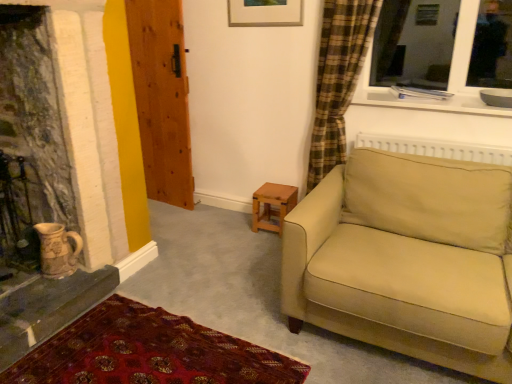
At what (x,y) coordinates should I click in order to perform the action: click on carpet with intricate patterns at lower left. Please return your answer as a coordinate pair (x, y). Looking at the image, I should click on (148, 352).

From the picture: Measure the distance between wooden table at center and camera.

wooden table at center and camera are 9.09 feet apart.

At what (x,y) coordinates should I click in order to perform the action: click on carpet with intricate patterns at lower left. Please return your answer as a coordinate pair (x, y). The width and height of the screenshot is (512, 384). Looking at the image, I should click on (148, 352).

Measure the distance between earthenware jug at lower left and beige fabric couch at right.

earthenware jug at lower left and beige fabric couch at right are 1.50 meters apart.

Does point (38, 223) lie in front of point (362, 317)?

No, it is not.

In terms of height, does earthenware jug at lower left look taller or shorter compared to beige fabric couch at right?

earthenware jug at lower left is shorter than beige fabric couch at right.

From a real-world perspective, is earthenware jug at lower left physically above beige fabric couch at right?

Incorrect, from a real-world perspective, earthenware jug at lower left is lower than beige fabric couch at right.

Locate an element on the screen. studio couch that appears above the wooden table at center (from a real-world perspective) is located at coordinates (407, 259).

Which is in front, beige fabric couch at right or wooden table at center?

beige fabric couch at right.

Is beige fabric couch at right inside or outside of wooden table at center?

beige fabric couch at right is not enclosed by wooden table at center.

Considering the relative sizes of beige fabric couch at right and wooden table at center in the image provided, is beige fabric couch at right bigger than wooden table at center?

Yes, beige fabric couch at right is bigger than wooden table at center.

Considering the relative sizes of carpet with intricate patterns at lower left and wooden door at left in the image provided, is carpet with intricate patterns at lower left bigger than wooden door at left?

No.

Considering the relative positions of carpet with intricate patterns at lower left and wooden door at left in the image provided, is carpet with intricate patterns at lower left to the left or to the right of wooden door at left?

Based on their positions, carpet with intricate patterns at lower left is located to the right of wooden door at left.

Measure the distance between carpet with intricate patterns at lower left and wooden door at left.

They are 5.15 feet apart.

Is carpet with intricate patterns at lower left not near wooden door at left?

Absolutely, carpet with intricate patterns at lower left is distant from wooden door at left.

Relative to earthenware jug at lower left, is beige fabric couch at right in front or behind?

Visually, beige fabric couch at right is located in front of earthenware jug at lower left.

Where is `tea pot below the beige fabric couch at right (from the image's perspective)`? Image resolution: width=512 pixels, height=384 pixels. tea pot below the beige fabric couch at right (from the image's perspective) is located at coordinates (58, 250).

In terms of width, does beige fabric couch at right look wider or thinner when compared to earthenware jug at lower left?

Clearly, beige fabric couch at right has more width compared to earthenware jug at lower left.

Is beige fabric couch at right not close to earthenware jug at lower left?

Yes, beige fabric couch at right is far from earthenware jug at lower left.

Consider the image. Does wooden door at left have a smaller size compared to wooden table at center?

No, wooden door at left is not smaller than wooden table at center.

Looking at this image, what's the angular difference between wooden door at left and wooden table at center's facing directions?

10.5 degrees separate the facing orientations of wooden door at left and wooden table at center.

Between wooden door at left and wooden table at center, which one appears on the left side from the viewer's perspective?

From the viewer's perspective, wooden door at left appears more on the left side.

From a real-world perspective, between wooden door at left and wooden table at center, who is vertically higher?

wooden door at left is physically above.

From a real-world perspective, is carpet with intricate patterns at lower left on beige fabric couch at right?

Incorrect, from a real-world perspective, carpet with intricate patterns at lower left is lower than beige fabric couch at right.

In the scene shown: Can you tell me how much carpet with intricate patterns at lower left and beige fabric couch at right differ in facing direction?

87.5 degrees.

Considering the relative positions of carpet with intricate patterns at lower left and beige fabric couch at right in the image provided, is carpet with intricate patterns at lower left to the left of beige fabric couch at right from the viewer's perspective?

Yes.

Does carpet with intricate patterns at lower left have a lesser width compared to wooden table at center?

No.

Is carpet with intricate patterns at lower left touching wooden table at center?

There is a gap between carpet with intricate patterns at lower left and wooden table at center.

Is carpet with intricate patterns at lower left not inside wooden table at center?

carpet with intricate patterns at lower left is positioned outside wooden table at center.

In order to click on studio couch that appears in front of the earthenware jug at lower left in this screenshot , I will do `click(407, 259)`.

At what (x,y) coordinates should I click in order to perform the action: click on table lying behind the beige fabric couch at right. Please return your answer as a coordinate pair (x, y). The image size is (512, 384). Looking at the image, I should click on (272, 206).

When comparing their distances from wooden door at left, does wooden table at center or beige fabric couch at right seem closer?

Among the two, wooden table at center is located nearer to wooden door at left.

Considering their positions, is beige fabric couch at right positioned closer to carpet with intricate patterns at lower left than wooden door at left?

beige fabric couch at right.

From the image, which object appears to be farther from wooden table at center, carpet with intricate patterns at lower left or wooden door at left?

Based on the image, carpet with intricate patterns at lower left appears to be further to wooden table at center.

From the image, which object appears to be farther from earthenware jug at lower left, wooden door at left or wooden table at center?

The object further to earthenware jug at lower left is wooden door at left.

Considering their positions, is wooden table at center positioned closer to beige fabric couch at right than carpet with intricate patterns at lower left?

carpet with intricate patterns at lower left is positioned closer to the anchor beige fabric couch at right.

From the image, which object appears to be farther from beige fabric couch at right, carpet with intricate patterns at lower left or wooden table at center?

Based on the image, wooden table at center appears to be further to beige fabric couch at right.

From the image, which object appears to be nearer to carpet with intricate patterns at lower left, wooden door at left or wooden table at center?

wooden table at center is closer to carpet with intricate patterns at lower left.

Estimate the real-world distances between objects in this image. Which object is closer to wooden table at center, earthenware jug at lower left or beige fabric couch at right?

Based on the image, beige fabric couch at right appears to be nearer to wooden table at center.

Find the location of `door situated between earthenware jug at lower left and beige fabric couch at right from left to right`. door situated between earthenware jug at lower left and beige fabric couch at right from left to right is located at coordinates (161, 98).

The image size is (512, 384). In order to click on studio couch between carpet with intricate patterns at lower left and wooden table at center in the front-back direction in this screenshot , I will do `click(407, 259)`.

Image resolution: width=512 pixels, height=384 pixels. Find the location of `tea pot located between carpet with intricate patterns at lower left and wooden door at left in the depth direction`. tea pot located between carpet with intricate patterns at lower left and wooden door at left in the depth direction is located at coordinates [x=58, y=250].

Locate an element on the screen. This screenshot has height=384, width=512. studio couch positioned between carpet with intricate patterns at lower left and wooden door at left from near to far is located at coordinates (407, 259).